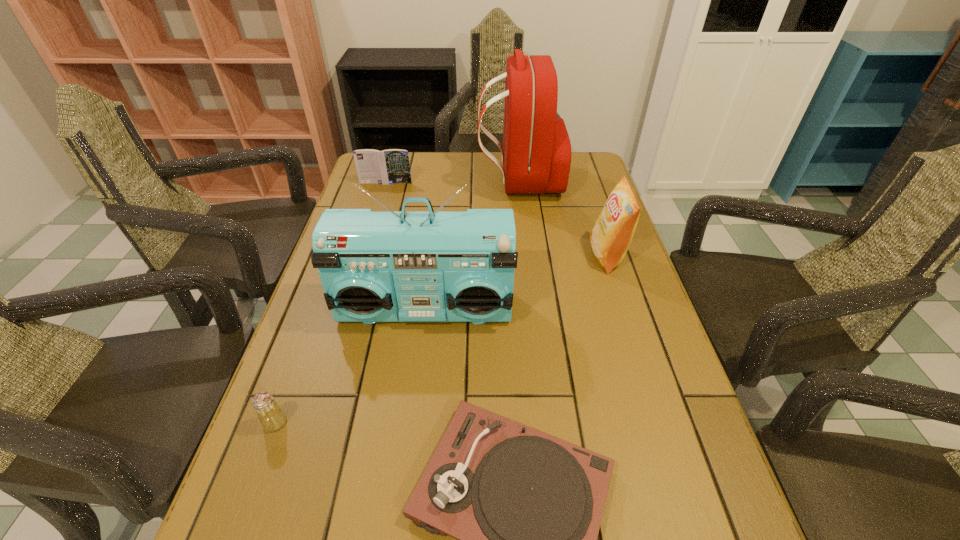
Locate an element on the screen. Image resolution: width=960 pixels, height=540 pixels. saltshaker that is positioned at the left edge is located at coordinates (271, 416).

Identify the location of backpack that is at the right edge. The image size is (960, 540). (536, 155).

You are a GUI agent. You are given a task and a screenshot of the screen. Output one action in this format:
    pyautogui.click(x=<x>, y=<y>)
    Task: Click on the crisp (potato chip) that is positioned at the right edge
    The image size is (960, 540).
    Given the screenshot: What is the action you would take?
    pyautogui.click(x=610, y=237)

Find the location of a particular element. object present at the far left corner is located at coordinates (390, 166).

Image resolution: width=960 pixels, height=540 pixels. Find the location of `object that is at the far right corner`. object that is at the far right corner is located at coordinates (536, 155).

Where is `vacant position at the far edge of the desktop`? vacant position at the far edge of the desktop is located at coordinates (500, 160).

I want to click on free spot at the left edge of the desktop, so click(x=349, y=415).

Where is `free space at the right edge of the desktop`? The height and width of the screenshot is (540, 960). free space at the right edge of the desktop is located at coordinates (573, 200).

Locate an element on the screen. This screenshot has height=540, width=960. vacant point located between the backpack and the crisp (potato chip) is located at coordinates (563, 218).

This screenshot has width=960, height=540. In order to click on free spot between the rightmost object and the radio receiver in this screenshot , I will do `click(516, 283)`.